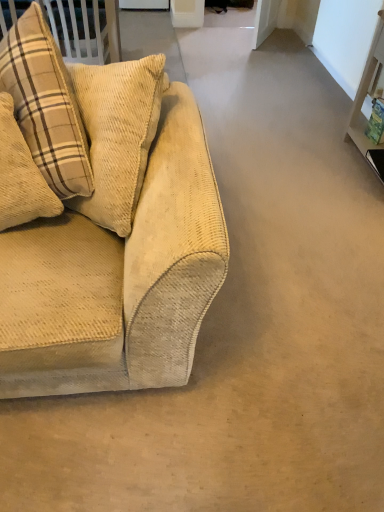
Question: Considering the positions of beige corduroy pillow at left and beige corduroy couch at left in the image, is beige corduroy pillow at left bigger or smaller than beige corduroy couch at left?

Choices:
 (A) small
 (B) big

Answer: (A)

Question: In terms of height, does beige corduroy pillow at left look taller or shorter compared to beige corduroy couch at left?

Choices:
 (A) short
 (B) tall

Answer: (A)

Question: Based on their positions, is beige corduroy pillow at left located to the left or right of beige corduroy couch at left?

Choices:
 (A) right
 (B) left

Answer: (B)

Question: Is beige corduroy couch at left wider or thinner than beige corduroy pillow at left?

Choices:
 (A) wide
 (B) thin

Answer: (A)

Question: Would you say beige corduroy couch at left is to the left or to the right of beige corduroy pillow at left in the picture?

Choices:
 (A) right
 (B) left

Answer: (A)

Question: From the image's perspective, is beige corduroy couch at left above or below beige corduroy pillow at left?

Choices:
 (A) below
 (B) above

Answer: (B)

Question: From a real-world perspective, relative to beige corduroy pillow at left, is beige corduroy couch at left vertically above or below?

Choices:
 (A) above
 (B) below

Answer: (B)